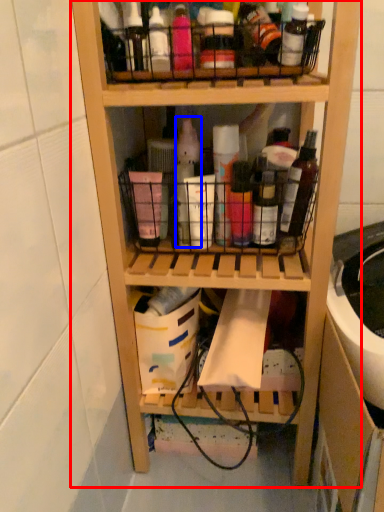
Question: Which point is further to the camera, shelf (highlighted by a red box) or bottle (highlighted by a blue box)?

Choices:
 (A) shelf
 (B) bottle

Answer: (B)